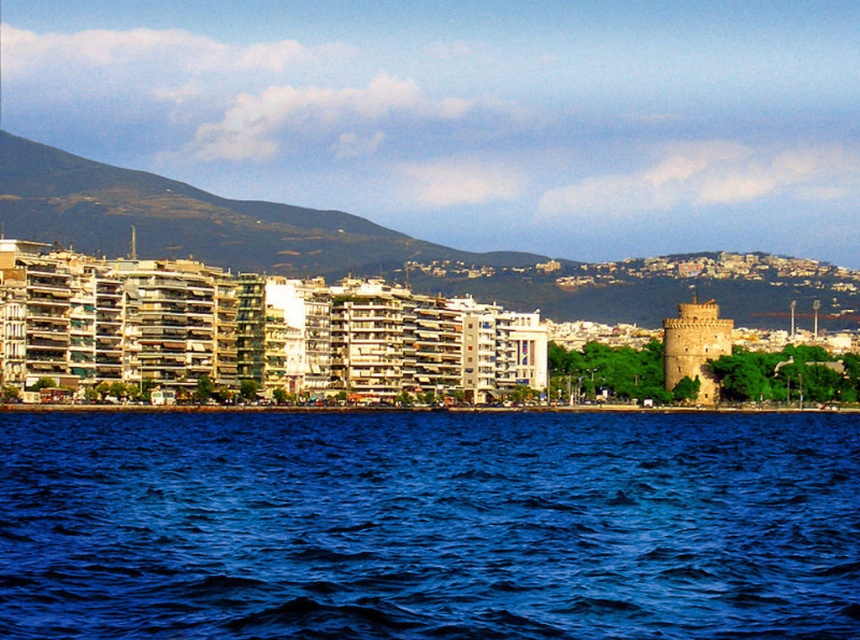
Which is behind, point (26, 620) or point (699, 324)?

Point (699, 324)

Who is more forward, (765,444) or (717,323)?

Point (765,444) is more forward.

The width and height of the screenshot is (860, 640). Identify the location of blue liquid water at lower center. (428, 525).

Which of these two, blue liquid water at lower center or green textured mountain at upper left, stands shorter?

With less height is blue liquid water at lower center.

Can you confirm if blue liquid water at lower center is wider than green textured mountain at upper left?

No, blue liquid water at lower center is not wider than green textured mountain at upper left.

The height and width of the screenshot is (640, 860). I want to click on blue liquid water at lower center, so click(428, 525).

Between green textured mountain at upper left and light brown stone tower at right, which one has more height?

With more height is green textured mountain at upper left.

Between point (262, 269) and point (690, 376), which one is positioned in front?

Point (690, 376)

Which is in front, point (410, 268) or point (717, 342)?

Point (717, 342) is in front.

Identify the location of green textured mountain at upper left. [x=381, y=248].